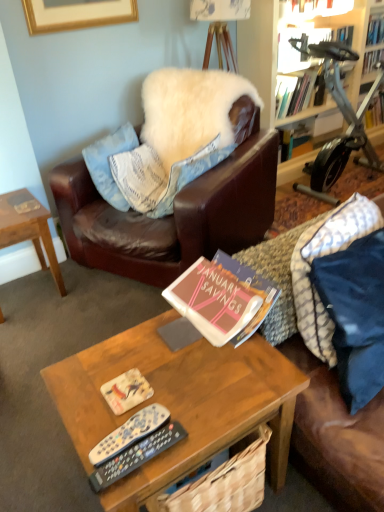
At what (x,y) coordinates should I click in order to perform the action: click on vacant area that lies between black plastic remote control at lower center, which is the first remote control from back to front, and matte paper book cover at center. Please return your answer as a coordinate pair (x, y). The height and width of the screenshot is (512, 384). Looking at the image, I should click on (114, 416).